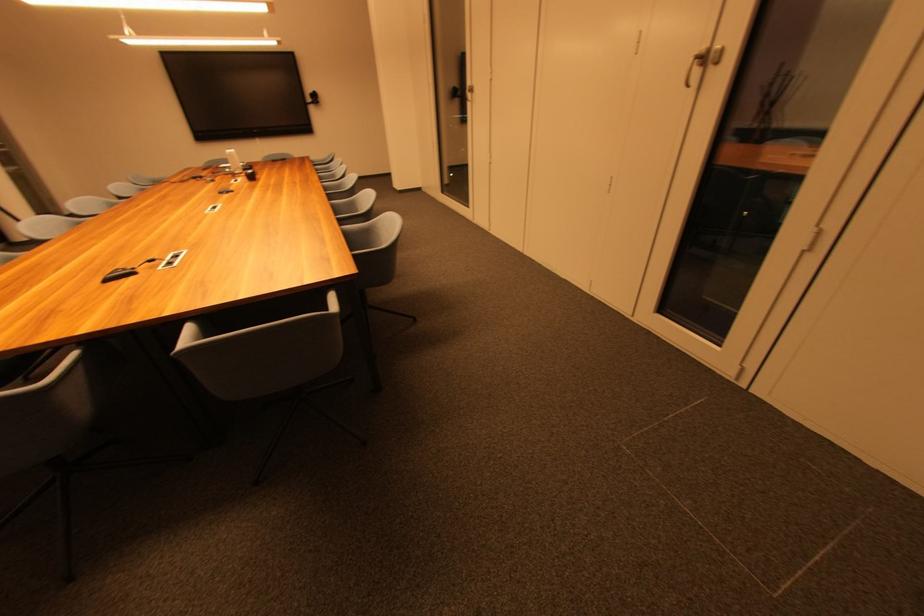
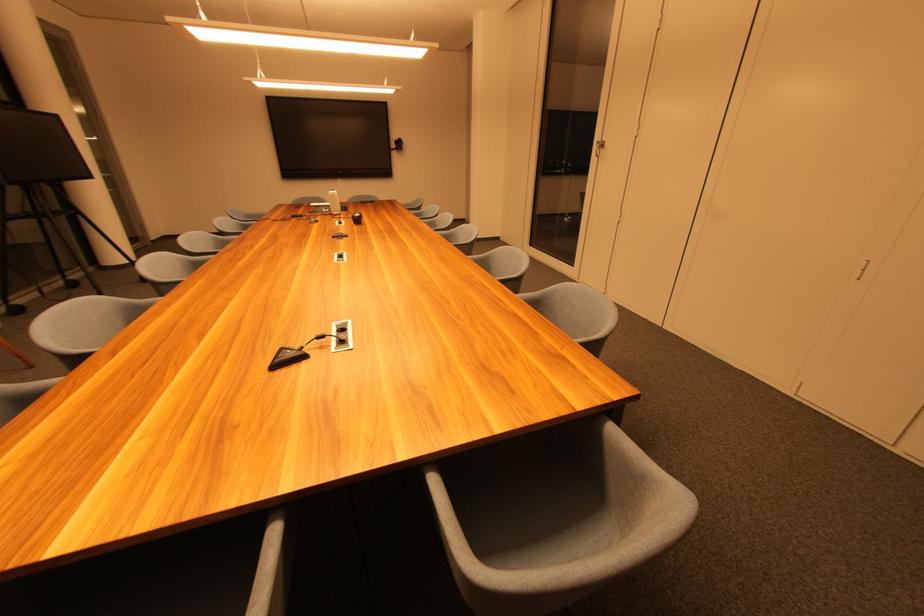
The point at (195, 331) is marked in the first image. Where is the corresponding point in the second image?

(440, 485)